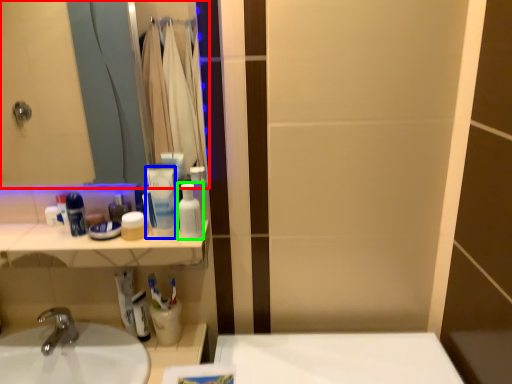
Question: Estimate the real-world distances between objects in this image. Which object is farther from mirror (highlighted by a red box), mouthwash (highlighted by a blue box) or mouthwash (highlighted by a green box)?

Choices:
 (A) mouthwash
 (B) mouthwash

Answer: (B)